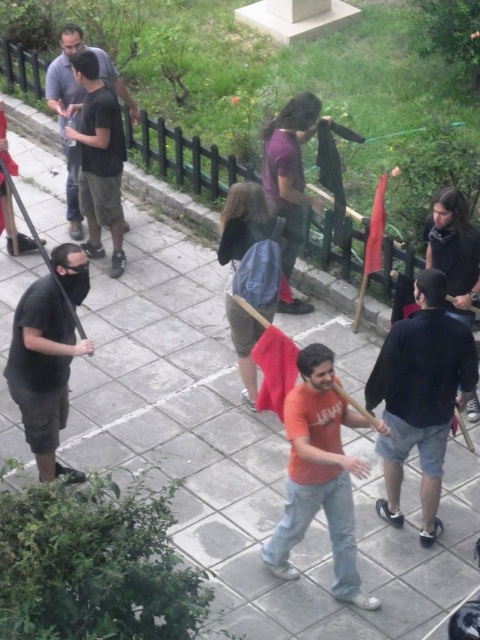
Is black matte t-shirt at left shorter than dark gray shirt at upper left?

Indeed, black matte t-shirt at left has a lesser height compared to dark gray shirt at upper left.

Looking at this image, is black matte t-shirt at left thinner than dark gray shirt at upper left?

Yes, black matte t-shirt at left is thinner than dark gray shirt at upper left.

Who is more forward, [45,365] or [127,93]?

Point [45,365] is more forward.

I want to click on black matte t-shirt at left, so click(44, 371).

Can you confirm if orange matte shirt at center is bigger than black matte t-shirt at left?

Indeed, orange matte shirt at center has a larger size compared to black matte t-shirt at left.

Does orange matte shirt at center lie in front of black matte t-shirt at left?

Yes, orange matte shirt at center is closer to the viewer.

Measure the distance between orange matte shirt at center and camera.

orange matte shirt at center is 19.11 feet from camera.

Identify the location of orange matte shirt at center. pos(319,476).

Looking at this image, is orange matte shirt at center bigger than purple matte shirt at center?

Yes, orange matte shirt at center is bigger than purple matte shirt at center.

Does orange matte shirt at center have a greater height compared to purple matte shirt at center?

Indeed, orange matte shirt at center has a greater height compared to purple matte shirt at center.

Locate an element on the screen. orange matte shirt at center is located at coordinates (319, 476).